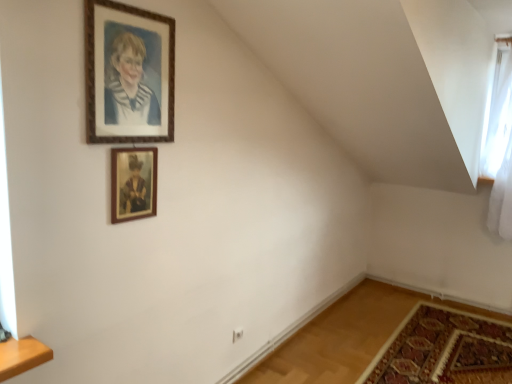
This screenshot has width=512, height=384. I want to click on white sheer curtain at upper right, so click(498, 112).

Find the location of a particular element. The width and height of the screenshot is (512, 384). picture frame that is the 1st object located in front of the white sheer curtain at upper right is located at coordinates (133, 183).

Which is in front, wooden picture frame at upper center, the first picture frame from the bottom, or white sheer curtain at upper right?

wooden picture frame at upper center, the first picture frame from the bottom, is more forward.

Is wooden picture frame at upper center, the first picture frame from the bottom, surrounding white sheer curtain at upper right?

Actually, white sheer curtain at upper right is outside wooden picture frame at upper center, the first picture frame from the bottom.

Does wooden picture frame at upper center, the 2th picture frame positioned from the top, appear on the right side of white sheer curtain at upper right?

In fact, wooden picture frame at upper center, the 2th picture frame positioned from the top, is to the left of white sheer curtain at upper right.

Between carpeted mat at lower right and wooden picture frame at upper center, the first picture frame from the bottom, which one has more height?

wooden picture frame at upper center, the first picture frame from the bottom.

From the image's perspective, which is below, carpeted mat at lower right or wooden picture frame at upper center, the first picture frame from the bottom?

carpeted mat at lower right appears lower in the image.

From the image's perspective, is white sheer curtain at upper right beneath wooden picture frame at upper center, the 2th picture frame positioned from the top?

Incorrect, from the image's perspective, white sheer curtain at upper right is higher than wooden picture frame at upper center, the 2th picture frame positioned from the top.

Would you say white sheer curtain at upper right is outside wooden picture frame at upper center, the first picture frame from the bottom?

Yes, white sheer curtain at upper right is not within wooden picture frame at upper center, the first picture frame from the bottom.

Can you confirm if white sheer curtain at upper right is shorter than wooden picture frame at upper center, the first picture frame from the bottom?

No, white sheer curtain at upper right is not shorter than wooden picture frame at upper center, the first picture frame from the bottom.

Which is in front, point (506, 107) or point (117, 184)?

The point (117, 184) is closer.

From the image's perspective, between wooden frame at upper center, the 2th picture frame from the bottom, and wooden picture frame at upper center, the first picture frame from the bottom, who is located below?

wooden picture frame at upper center, the first picture frame from the bottom, from the image's perspective.

Can you confirm if wooden frame at upper center, the 1th picture frame from the top, is positioned to the left of wooden picture frame at upper center, the 2th picture frame positioned from the top?

Incorrect, wooden frame at upper center, the 1th picture frame from the top, is not on the left side of wooden picture frame at upper center, the 2th picture frame positioned from the top.

From a real-world perspective, who is located lower, wooden frame at upper center, the 2th picture frame from the bottom, or wooden picture frame at upper center, the 2th picture frame positioned from the top?

wooden picture frame at upper center, the 2th picture frame positioned from the top.

Is white sheer curtain at upper right aimed at wooden frame at upper center, the 2th picture frame from the bottom?

No, white sheer curtain at upper right is not aimed at wooden frame at upper center, the 2th picture frame from the bottom.

You are a GUI agent. You are given a task and a screenshot of the screen. Output one action in this format:
    pyautogui.click(x=<x>, y=<y>)
    Task: Click on the picture frame located above the white sheer curtain at upper right (from a real-world perspective)
    
    Given the screenshot: What is the action you would take?
    pyautogui.click(x=128, y=74)

Considering the sizes of white sheer curtain at upper right and wooden frame at upper center, the 1th picture frame from the top, in the image, is white sheer curtain at upper right taller or shorter than wooden frame at upper center, the 1th picture frame from the top,?

In the image, white sheer curtain at upper right appears to be taller than wooden frame at upper center, the 1th picture frame from the top.

Considering the positions of objects white sheer curtain at upper right and wooden frame at upper center, the 1th picture frame from the top, in the image provided, who is more to the left, white sheer curtain at upper right or wooden frame at upper center, the 1th picture frame from the top,?

A: From the viewer's perspective, wooden frame at upper center, the 1th picture frame from the top, appears more on the left side.

Does wooden picture frame at upper center, the 2th picture frame positioned from the top, come in front of wooden frame at upper center, the 1th picture frame from the top?

No, wooden picture frame at upper center, the 2th picture frame positioned from the top, is further to the viewer.

Is wooden picture frame at upper center, the first picture frame from the bottom, shorter than wooden frame at upper center, the 1th picture frame from the top?

Indeed, wooden picture frame at upper center, the first picture frame from the bottom, has a lesser height compared to wooden frame at upper center, the 1th picture frame from the top.

Identify the location of picture frame positioned vertically above the wooden picture frame at upper center, the first picture frame from the bottom (from a real-world perspective). (128, 74).

Can you tell me how much wooden picture frame at upper center, the first picture frame from the bottom, and wooden frame at upper center, the 2th picture frame from the bottom, differ in facing direction?

There is a 0.00737-degree angle between the facing directions of wooden picture frame at upper center, the first picture frame from the bottom, and wooden frame at upper center, the 2th picture frame from the bottom.

From the picture: Considering the relative sizes of white sheer curtain at upper right and carpeted mat at lower right in the image provided, is white sheer curtain at upper right bigger than carpeted mat at lower right?

Yes.

Are white sheer curtain at upper right and carpeted mat at lower right far apart?

That's right, there is a large distance between white sheer curtain at upper right and carpeted mat at lower right.

Visually, is white sheer curtain at upper right positioned to the left or to the right of carpeted mat at lower right?

Based on their positions, white sheer curtain at upper right is located to the right of carpeted mat at lower right.

Who is taller, white sheer curtain at upper right or carpeted mat at lower right?

With more height is white sheer curtain at upper right.

Identify the location of window above the wooden picture frame at upper center, the 2th picture frame positioned from the top (from a real-world perspective). (498, 112).

The height and width of the screenshot is (384, 512). What are the coordinates of `mat below the wooden picture frame at upper center, the first picture frame from the bottom (from a real-world perspective)` in the screenshot? It's located at (442, 349).

Considering their positions, is wooden frame at upper center, the 2th picture frame from the bottom, positioned further to wooden picture frame at upper center, the 2th picture frame positioned from the top, than carpeted mat at lower right?

carpeted mat at lower right lies further to wooden picture frame at upper center, the 2th picture frame positioned from the top, than the other object.

Looking at the image, which one is located further to wooden frame at upper center, the 2th picture frame from the bottom, carpeted mat at lower right or white sheer curtain at upper right?

The object further to wooden frame at upper center, the 2th picture frame from the bottom, is white sheer curtain at upper right.

Estimate the real-world distances between objects in this image. Which object is further from white sheer curtain at upper right, wooden picture frame at upper center, the 2th picture frame positioned from the top, or carpeted mat at lower right?

wooden picture frame at upper center, the 2th picture frame positioned from the top, lies further to white sheer curtain at upper right than the other object.

Based on their spatial positions, is white sheer curtain at upper right or carpeted mat at lower right closer to wooden frame at upper center, the 2th picture frame from the bottom?

carpeted mat at lower right is positioned closer to the anchor wooden frame at upper center, the 2th picture frame from the bottom.

Which object lies further to the anchor point wooden picture frame at upper center, the 2th picture frame positioned from the top, white sheer curtain at upper right or carpeted mat at lower right?

The object further to wooden picture frame at upper center, the 2th picture frame positioned from the top, is white sheer curtain at upper right.

When comparing their distances from wooden picture frame at upper center, the 2th picture frame positioned from the top, does carpeted mat at lower right or wooden frame at upper center, the 1th picture frame from the top, seem further?

carpeted mat at lower right lies further to wooden picture frame at upper center, the 2th picture frame positioned from the top, than the other object.

Based on their spatial positions, is wooden picture frame at upper center, the 2th picture frame positioned from the top, or white sheer curtain at upper right closer to carpeted mat at lower right?

white sheer curtain at upper right is closer to carpeted mat at lower right.

Looking at the image, which one is located closer to carpeted mat at lower right, wooden frame at upper center, the 1th picture frame from the top, or wooden picture frame at upper center, the first picture frame from the bottom?

Based on the image, wooden picture frame at upper center, the first picture frame from the bottom, appears to be nearer to carpeted mat at lower right.

At what (x,y) coordinates should I click in order to perform the action: click on picture frame between wooden picture frame at upper center, the first picture frame from the bottom, and carpeted mat at lower right from left to right. Please return your answer as a coordinate pair (x, y). Image resolution: width=512 pixels, height=384 pixels. Looking at the image, I should click on (128, 74).

This screenshot has width=512, height=384. I want to click on mat between wooden picture frame at upper center, the first picture frame from the bottom, and white sheer curtain at upper right from left to right, so click(442, 349).

This screenshot has width=512, height=384. I want to click on mat situated between wooden frame at upper center, the 2th picture frame from the bottom, and white sheer curtain at upper right from left to right, so click(x=442, y=349).

Locate an element on the screen. picture frame between wooden picture frame at upper center, the first picture frame from the bottom, and white sheer curtain at upper right is located at coordinates (128, 74).